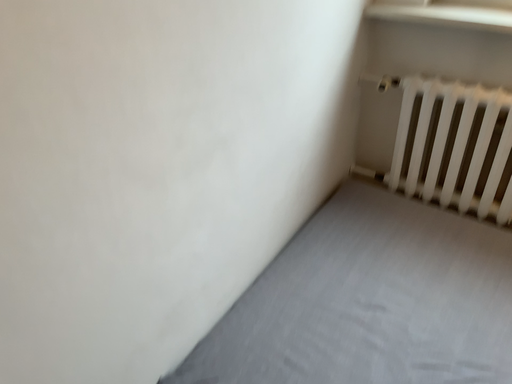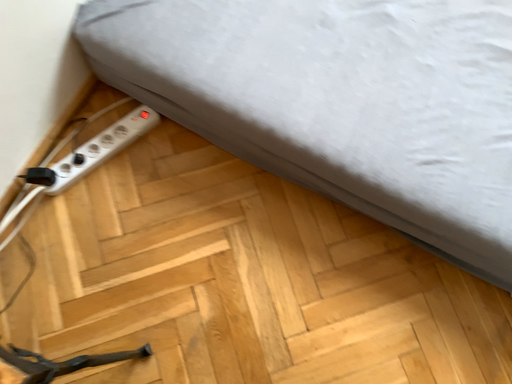
Question: How did the camera likely rotate when shooting the video?

Choices:
 (A) rotated left
 (B) rotated right

Answer: (B)